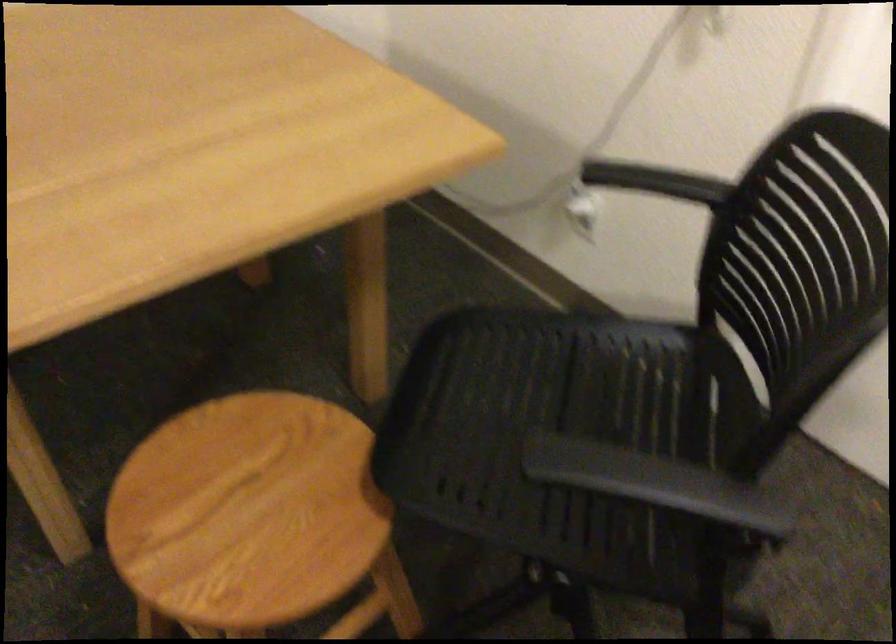
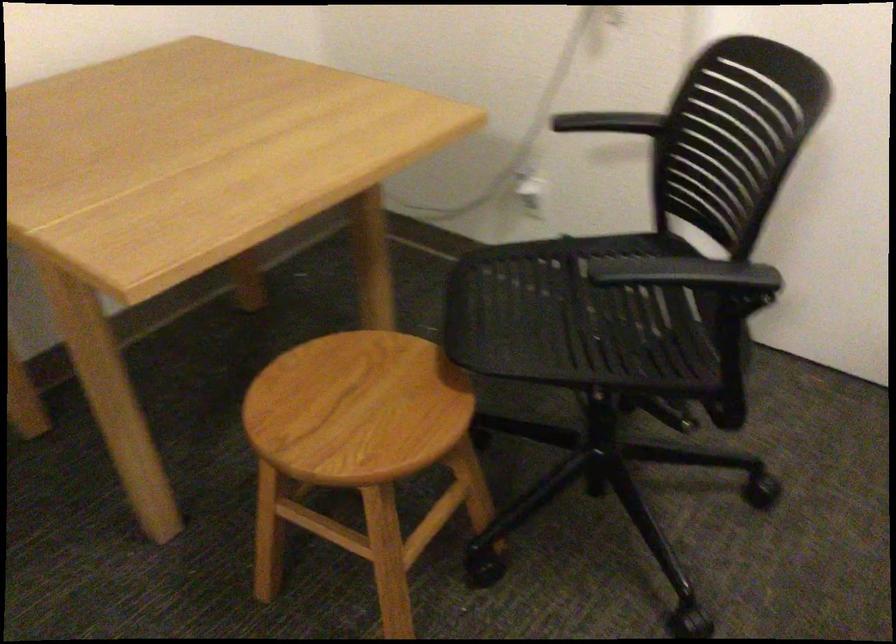
Where in the second image is the point corresponding to (657,185) from the first image?

(607, 122)